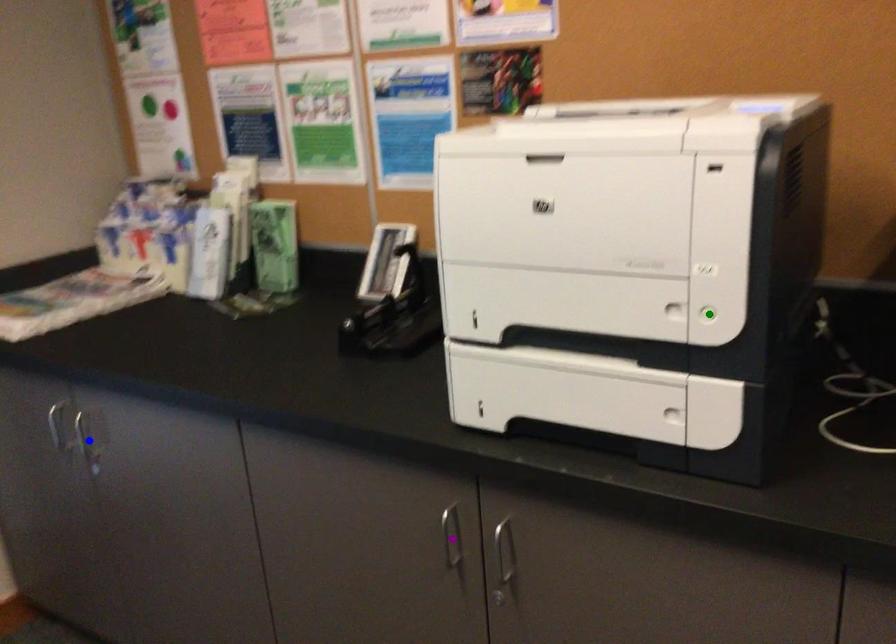
Order these from nearest to farthest:
green point, blue point, purple point

green point
purple point
blue point